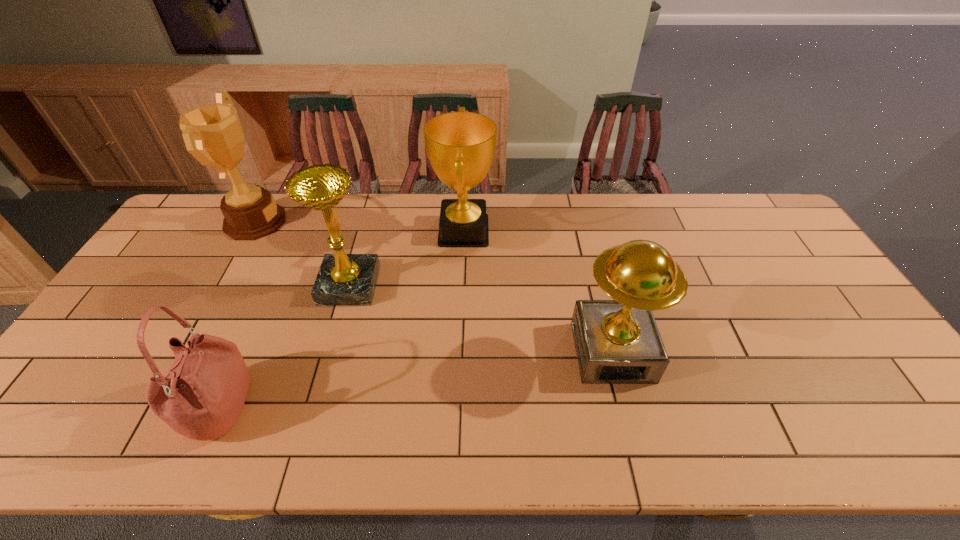
Where is `vacant area situated on the front-facing side of the nearest award`? The width and height of the screenshot is (960, 540). vacant area situated on the front-facing side of the nearest award is located at coordinates (636, 451).

This screenshot has height=540, width=960. Find the location of `vacant region located on the right of the handbag`. vacant region located on the right of the handbag is located at coordinates (324, 408).

Locate an element on the screen. Image resolution: width=960 pixels, height=540 pixels. object present at the near edge is located at coordinates coord(201,396).

You are a GUI agent. You are given a task and a screenshot of the screen. Output one action in this format:
    pyautogui.click(x=<x>, y=<y>)
    Task: Click on the object located in the left edge section of the desktop
    The width and height of the screenshot is (960, 540).
    Given the screenshot: What is the action you would take?
    pyautogui.click(x=213, y=134)

Where is `object located in the far left corner section of the desktop`? object located in the far left corner section of the desktop is located at coordinates (213, 134).

Locate an element on the screen. The height and width of the screenshot is (540, 960). vacant space at the far edge of the desktop is located at coordinates (530, 215).

Locate an element on the screen. The height and width of the screenshot is (540, 960). vacant space at the left edge is located at coordinates (95, 372).

Locate an element on the screen. This screenshot has width=960, height=540. free spot at the right edge of the desktop is located at coordinates (771, 266).

In the image, there is a desktop. At what (x,y) coordinates should I click in order to perform the action: click on vacant space at the far left corner. Please return your answer as a coordinate pair (x, y). The image size is (960, 540). Looking at the image, I should click on (210, 207).

The image size is (960, 540). I want to click on vacant area that lies between the third object from right to left and the leftmost award, so click(302, 253).